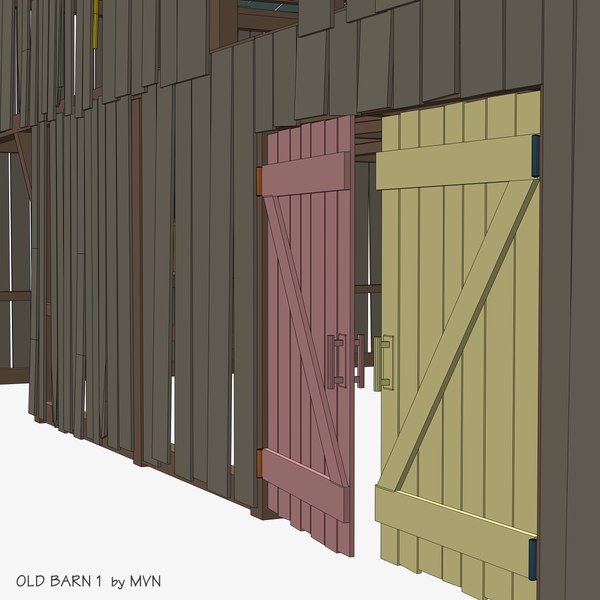
I want to click on wall, so click(x=332, y=435).